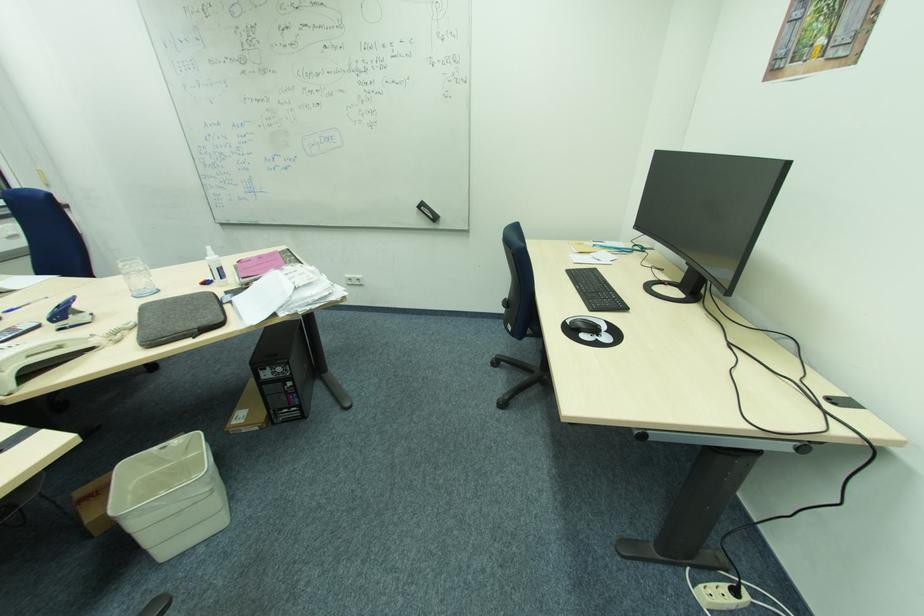
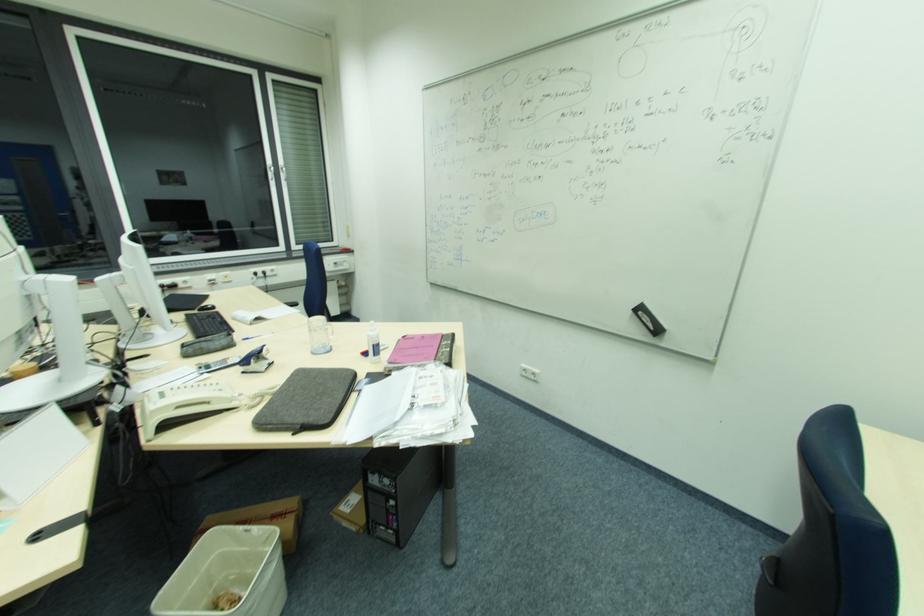
Question: Based on the continuous images, in which direction is the camera rotating? Reply with the corresponding letter.

Choices:
 (A) Left
 (B) Right
 (C) Up
 (D) Down

Answer: (A)